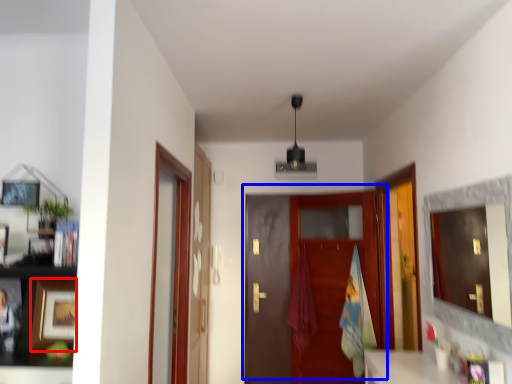
Question: Which object is further to the camera taking this photo, picture frame (highlighted by a red box) or door (highlighted by a blue box)?

Choices:
 (A) picture frame
 (B) door

Answer: (B)